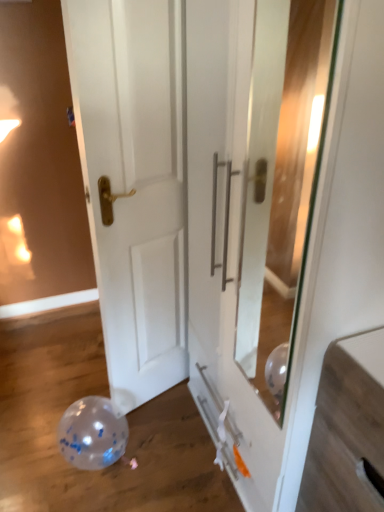
The width and height of the screenshot is (384, 512). What are the coordinates of `free location in front of white glossy door at center` in the screenshot? It's located at (169, 437).